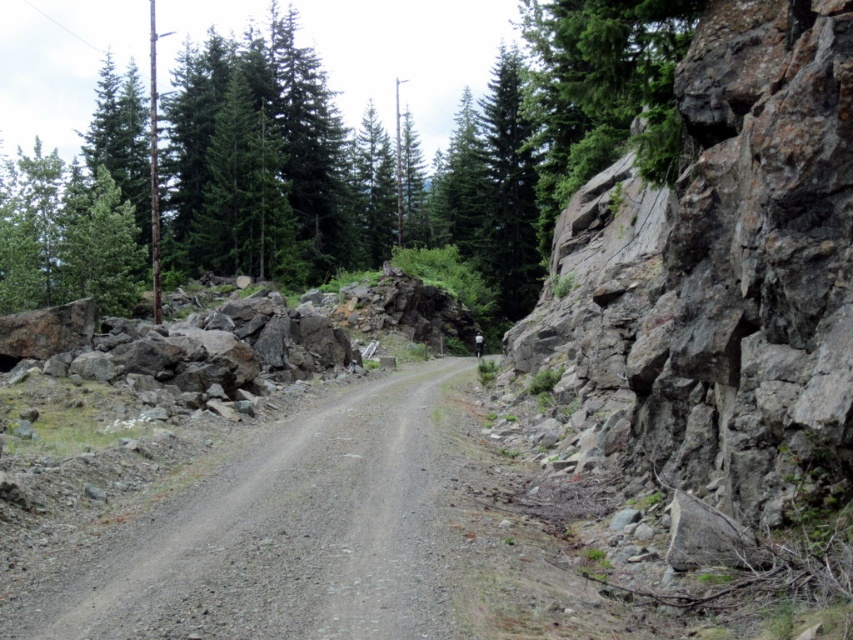
You are a hiker navigating a forest trail and notice a point marked at coordinates [337,163]. Based on the scene description, can you determine what terrain feature this point is located on?

The point is located on a green textured rock at upper right.